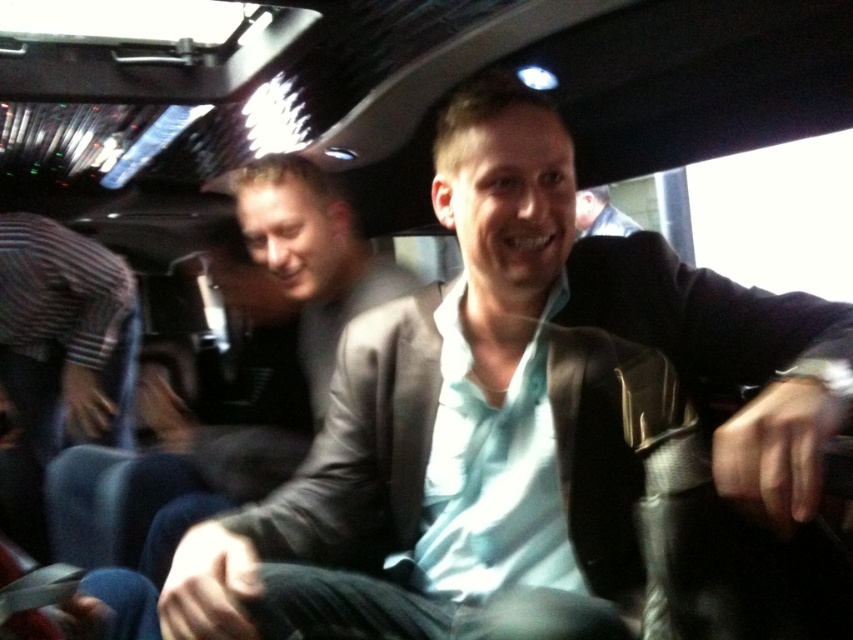
Question: Is striped fabric shirt at lower left thinner than light blue shirt at center?

Choices:
 (A) no
 (B) yes

Answer: (A)

Question: Is striped fabric shirt at lower left closer to camera compared to light blue shirt at center?

Choices:
 (A) no
 (B) yes

Answer: (B)

Question: Which of the following is the farthest from the observer?

Choices:
 (A) striped fabric shirt at lower left
 (B) light blue shirt at center

Answer: (B)

Question: Among these objects, which one is nearest to the camera?

Choices:
 (A) striped fabric shirt at lower left
 (B) light blue shirt at center

Answer: (A)

Question: Is striped fabric shirt at lower left above light blue shirt at center?

Choices:
 (A) yes
 (B) no

Answer: (B)

Question: Which point is farther to the camera?

Choices:
 (A) (82, 396)
 (B) (614, 232)

Answer: (B)